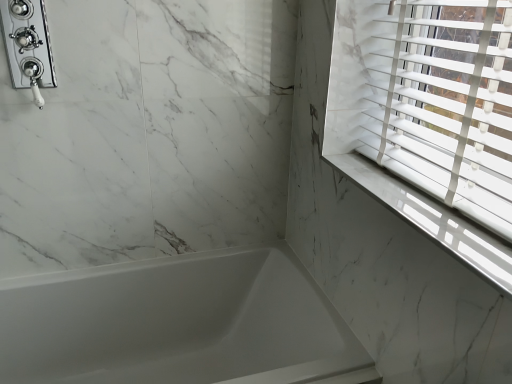
Question: Is chrome/polished metal shower at upper left spatially inside white marble window sill at upper right, or outside of it?

Choices:
 (A) outside
 (B) inside

Answer: (A)

Question: Based on their positions, is chrome/polished metal shower at upper left located to the left or right of white marble window sill at upper right?

Choices:
 (A) left
 (B) right

Answer: (A)

Question: Which is farther from the white glossy bathtub at lower left?

Choices:
 (A) chrome/polished metal shower at upper left
 (B) white marble window sill at upper right

Answer: (A)

Question: Estimate the real-world distances between objects in this image. Which object is closer to the white marble window sill at upper right?

Choices:
 (A) white glossy bathtub at lower left
 (B) chrome/polished metal shower at upper left

Answer: (A)